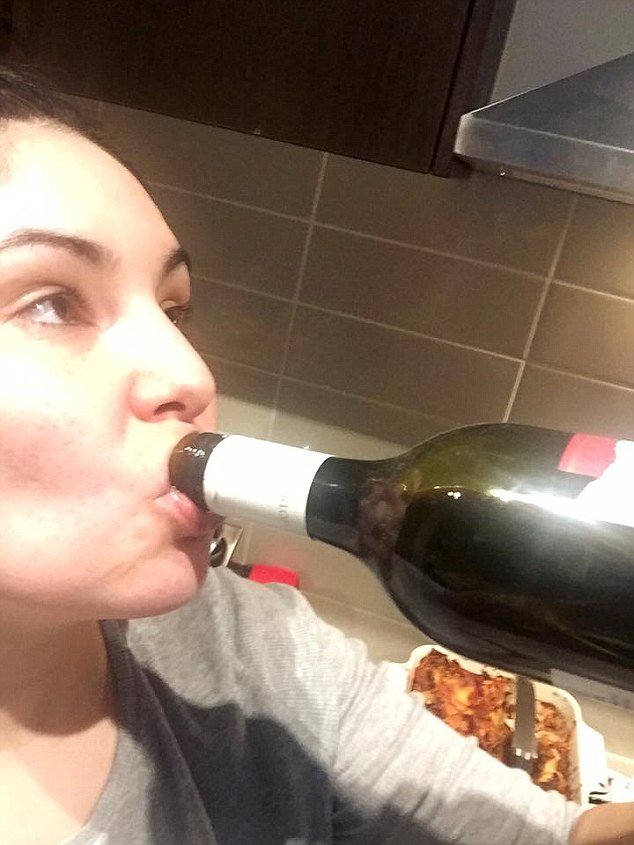
Image resolution: width=634 pixels, height=845 pixels. Find the location of `wall`. wall is located at coordinates (409, 363).